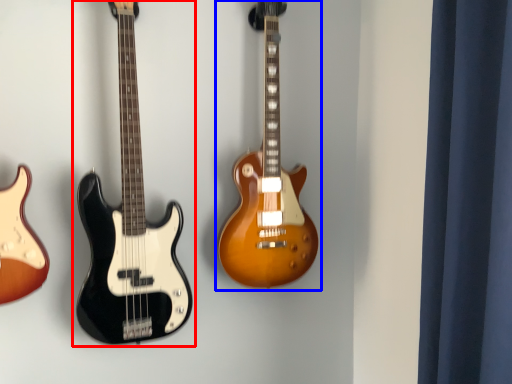
Question: Which object is closer to the camera taking this photo, guitar (highlighted by a red box) or guitar (highlighted by a blue box)?

Choices:
 (A) guitar
 (B) guitar

Answer: (A)